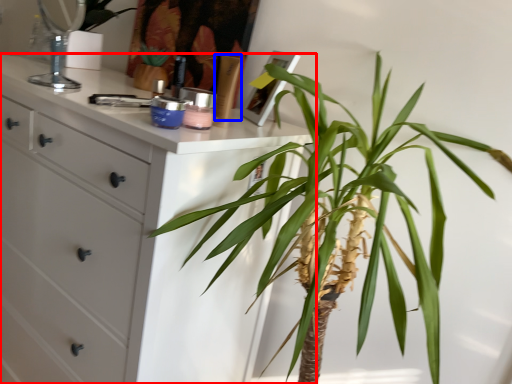
Question: Which object appears farthest to the camera in this image, chest of drawers (highlighted by a red box) or toiletry (highlighted by a blue box)?

Choices:
 (A) chest of drawers
 (B) toiletry

Answer: (B)